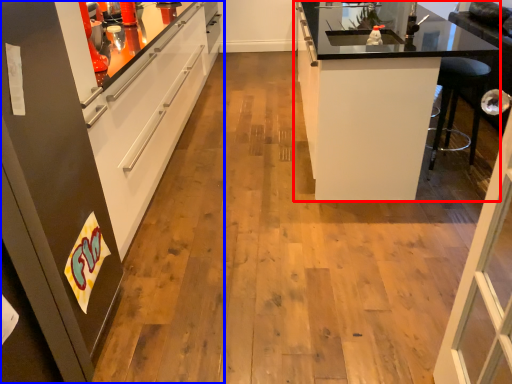
Question: Which point is closer to the camera, cabinetry (highlighted by a red box) or cabinetry (highlighted by a blue box)?

Choices:
 (A) cabinetry
 (B) cabinetry

Answer: (B)